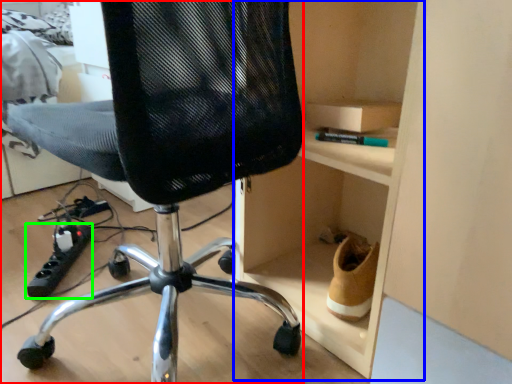
Question: Estimate the real-world distances between objects in this image. Which object is farther from chair (highlighted by a red box), cabinet (highlighted by a blue box) or equipment (highlighted by a green box)?

Choices:
 (A) cabinet
 (B) equipment

Answer: (B)